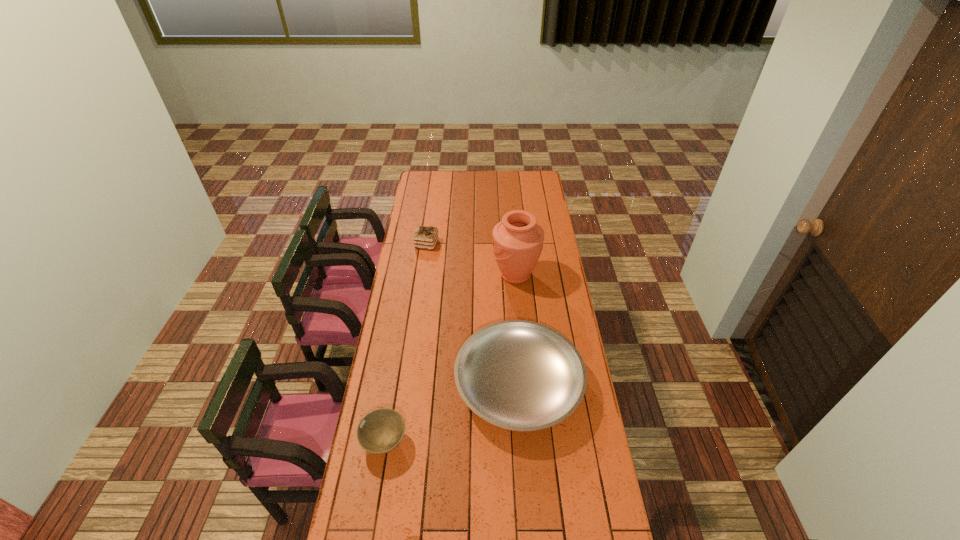
In order to click on vacant area between the bowl and the farthest object in this screenshot , I will do `click(406, 343)`.

I want to click on free space between the vase and the bowl, so click(450, 359).

Image resolution: width=960 pixels, height=540 pixels. Identify the location of free spot between the farthest object and the bedpan. [472, 314].

Locate an element on the screen. This screenshot has width=960, height=540. vacant area between the chocolate cake and the bowl is located at coordinates 406,343.

Identify the location of free point between the farthest object and the bedpan. (472, 314).

The height and width of the screenshot is (540, 960). What are the coordinates of `vacant region between the bowl and the bedpan` in the screenshot? It's located at (451, 413).

Where is `object that is the closest to the vase`? The image size is (960, 540). object that is the closest to the vase is located at coordinates pos(520,375).

Locate an element on the screen. The height and width of the screenshot is (540, 960). object that is the second nearest to the third nearest object is located at coordinates (425, 237).